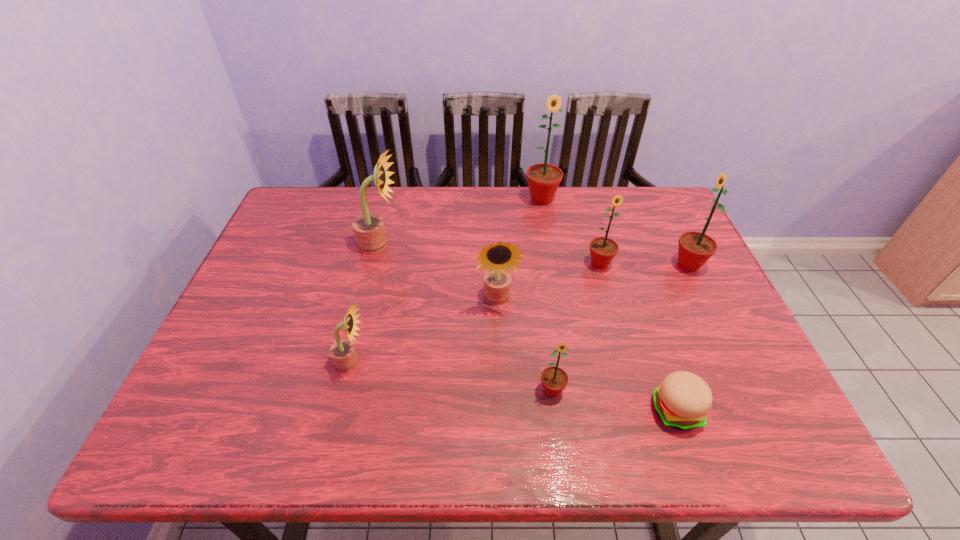
What are the coordinates of `vacant region between the third nearest sunflower and the second nearest sunflower` in the screenshot? It's located at (424, 331).

The image size is (960, 540). I want to click on unoccupied area between the second biggest green sunflower and the farthest yellow sunflower, so click(534, 255).

Find the location of `object identified as the closest to the smallest green sunflower`. object identified as the closest to the smallest green sunflower is located at coordinates (683, 399).

Locate which object ranks in proximity to the biggest yellow sunflower. Please provide its 2D coordinates. Your answer should be formatted as a tuple, i.e. [(x, y)], where the tuple contains the x and y coordinates of a point satisfying the conditions above.

[(499, 257)]

Where is `sunflower that is the third closest to the second green sunflower from right to left`? sunflower that is the third closest to the second green sunflower from right to left is located at coordinates (543, 179).

At what (x,y) coordinates should I click in order to perform the action: click on sunflower that stands as the second closest to the second smallest green sunflower. Please return your answer as a coordinate pair (x, y). The width and height of the screenshot is (960, 540). Looking at the image, I should click on (499, 257).

Identify which green sunflower is the fourth closest to the biggest yellow sunflower. Please provide its 2D coordinates. Your answer should be formatted as a tuple, i.e. [(x, y)], where the tuple contains the x and y coordinates of a point satisfying the conditions above.

[(695, 248)]

Identify which green sunflower is located as the nearest to the third nearest object. Please provide its 2D coordinates. Your answer should be formatted as a tuple, i.e. [(x, y)], where the tuple contains the x and y coordinates of a point satisfying the conditions above.

[(554, 379)]

This screenshot has width=960, height=540. What are the coordinates of `yellow sunflower identified as the third closest to the hamburger` in the screenshot? It's located at (369, 229).

At what (x,y) coordinates should I click in order to perform the action: click on yellow sunflower that is the second closest to the fourth nearest object. Please return your answer as a coordinate pair (x, y). This screenshot has height=540, width=960. Looking at the image, I should click on (342, 352).